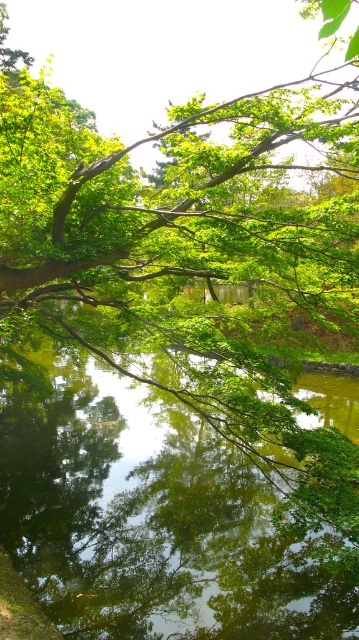
You are standing in the serene natural scene and want to locate the green leafy branch at upper center. Based on the coordinates provided, where would you look to find it?

The green leafy branch at upper center is located at point coordinates of 0.317 on the x axis and 0.518 on the y axis.

You are an artist planning to paint this scene. You want to ensure that the green leafy branch at upper center and the green reflective water at center are proportionally accurate. Which object should you make wider in your painting?

The green leafy branch at upper center should be made wider in the painting since its width is larger than the green reflective water at center according to the description.

In the serene natural scene, you notice a green leafy branch at upper center and a green reflective water at center. Which object occupies a larger area in the image?

The green leafy branch at upper center is bigger than the green reflective water at center, so it occupies a larger area in the image.